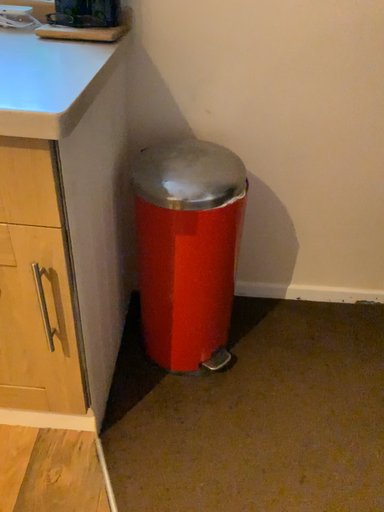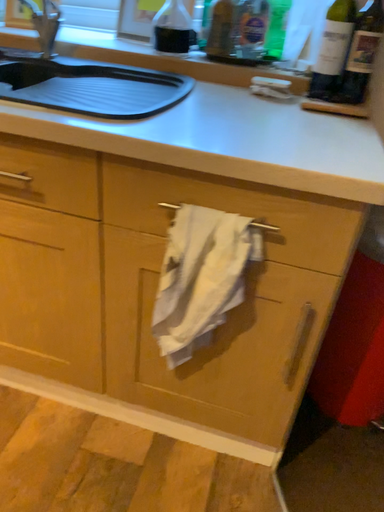
Question: How did the camera likely rotate when shooting the video?

Choices:
 (A) rotated left
 (B) rotated right

Answer: (A)